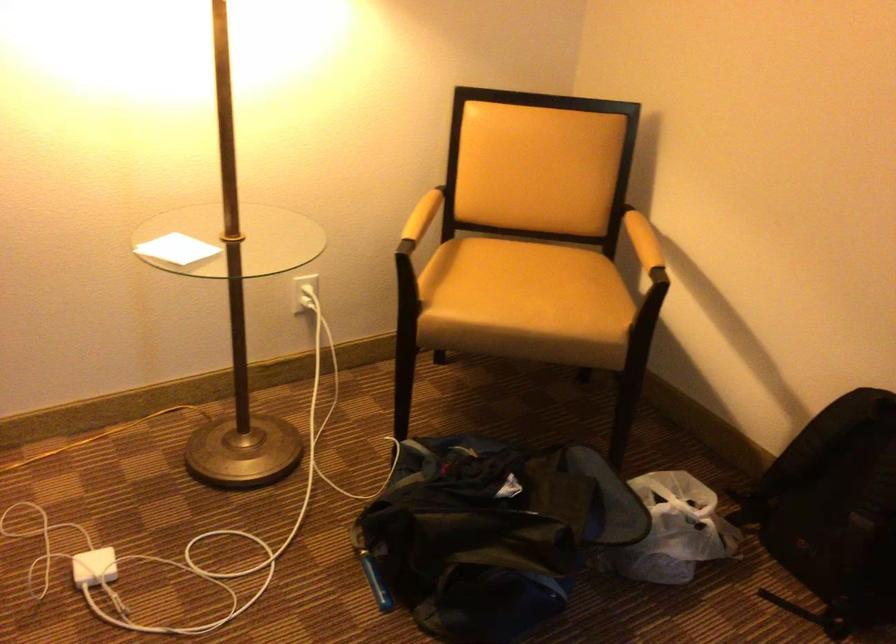
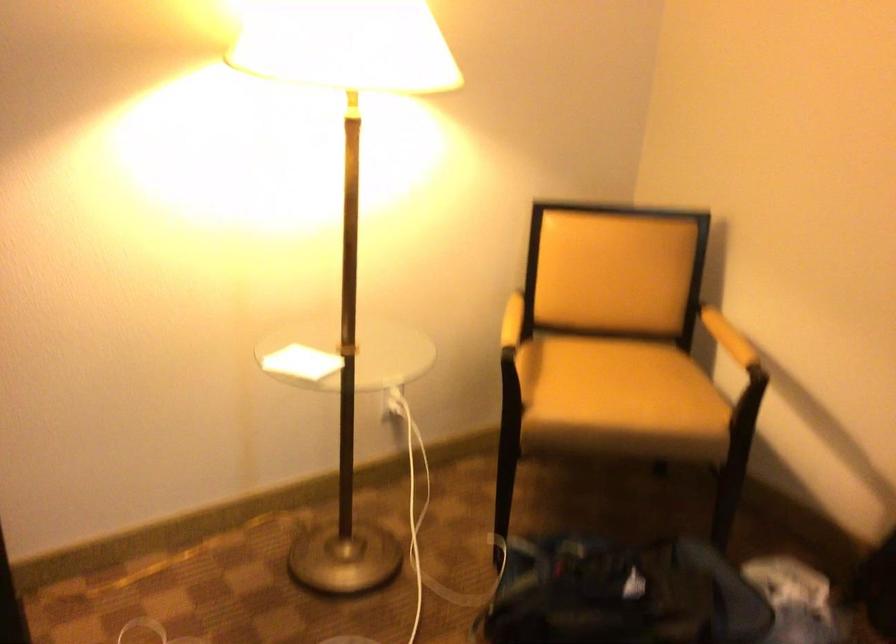
In the second image, find the point that corresponds to (x=527, y=290) in the first image.

(618, 388)